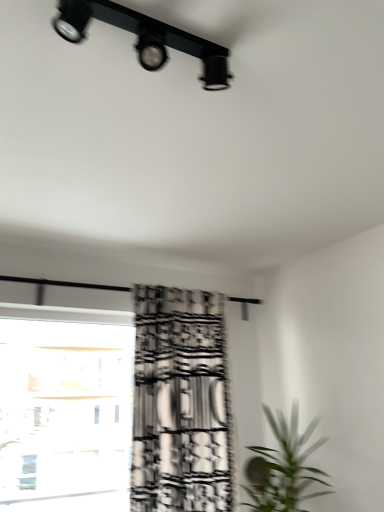
Question: Is black matte track light at upper center oriented towards black printed fabric curtain at center?

Choices:
 (A) no
 (B) yes

Answer: (A)

Question: From the image's perspective, is black matte track light at upper center above black printed fabric curtain at center?

Choices:
 (A) yes
 (B) no

Answer: (A)

Question: From the image's perspective, is black matte track light at upper center beneath black printed fabric curtain at center?

Choices:
 (A) no
 (B) yes

Answer: (A)

Question: Are black matte track light at upper center and black printed fabric curtain at center making contact?

Choices:
 (A) yes
 (B) no

Answer: (B)

Question: From a real-world perspective, is black matte track light at upper center over black printed fabric curtain at center?

Choices:
 (A) yes
 (B) no

Answer: (A)

Question: Could black printed fabric curtain at center be considered to be inside black matte track light at upper center?

Choices:
 (A) no
 (B) yes

Answer: (A)

Question: Can you confirm if transparent glass window at lower left is positioned to the right of black printed fabric curtain at center?

Choices:
 (A) yes
 (B) no

Answer: (B)

Question: From a real-world perspective, is transparent glass window at lower left on black printed fabric curtain at center?

Choices:
 (A) no
 (B) yes

Answer: (A)

Question: Could black printed fabric curtain at center be considered to be inside transparent glass window at lower left?

Choices:
 (A) no
 (B) yes

Answer: (A)

Question: Is transparent glass window at lower left directly adjacent to black printed fabric curtain at center?

Choices:
 (A) no
 (B) yes

Answer: (A)

Question: Is transparent glass window at lower left aimed at black printed fabric curtain at center?

Choices:
 (A) yes
 (B) no

Answer: (B)

Question: Is transparent glass window at lower left taller than black printed fabric curtain at center?

Choices:
 (A) yes
 (B) no

Answer: (B)

Question: Is transparent glass window at lower left facing towards green leafy plant at lower right?

Choices:
 (A) no
 (B) yes

Answer: (A)